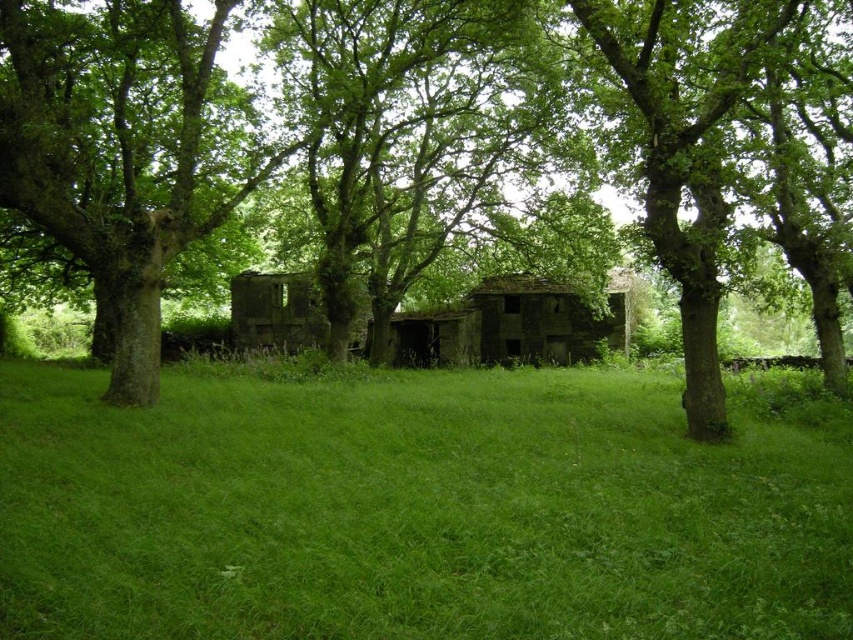
What do you see at coordinates (412, 512) in the screenshot?
I see `green grassy field at center` at bounding box center [412, 512].

Is point (619, 481) positioned in front of point (57, 32)?

Yes.

In order to click on green grassy field at center in this screenshot , I will do `click(412, 512)`.

Is point (263, 506) more distant than point (686, 140)?

No, (263, 506) is in front of (686, 140).

Which of these two, green grassy field at center or green leafy tree at center, stands taller?

With more height is green leafy tree at center.

Does point (827, 632) lie in front of point (531, 49)?

Yes.

Find the location of a particular element. This screenshot has height=640, width=853. green grassy field at center is located at coordinates (412, 512).

Who is shorter, green leafy tree at center or green rough bark tree at left?

Standing shorter between the two is green rough bark tree at left.

Find the location of `green leafy tree at center`. green leafy tree at center is located at coordinates (210, 129).

Where is `green leafy tree at center`? green leafy tree at center is located at coordinates (210, 129).